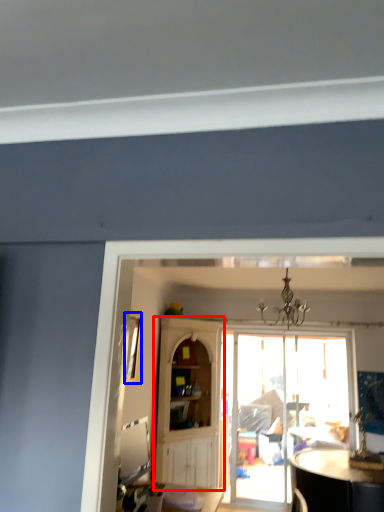
Question: Which point is closer to the camera, cabinetry (highlighted by a red box) or window (highlighted by a blue box)?

Choices:
 (A) cabinetry
 (B) window

Answer: (B)